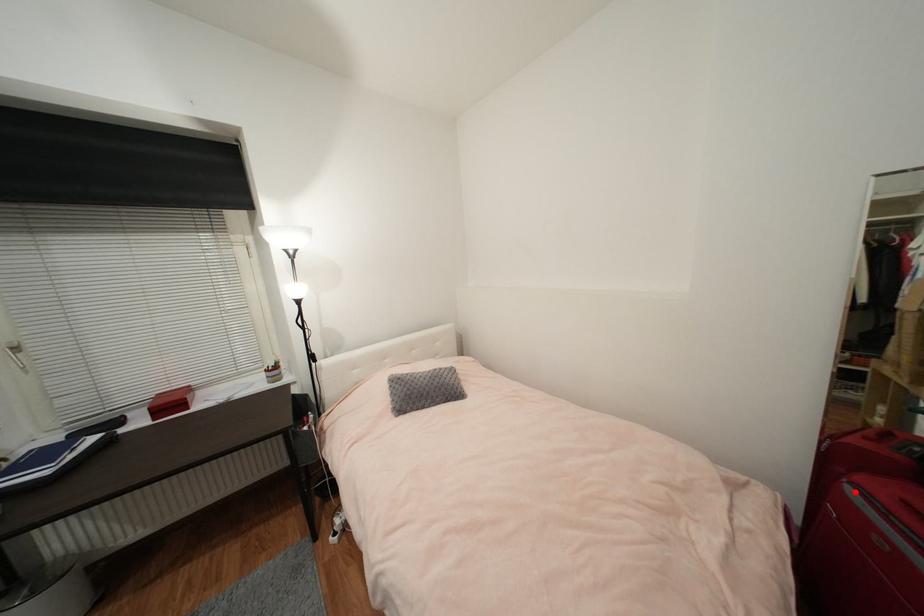
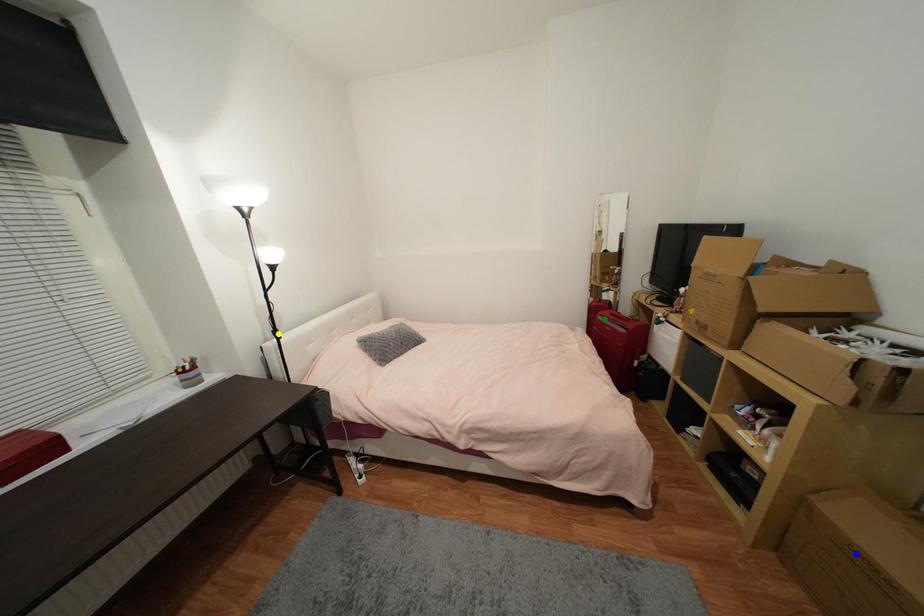
Question: I am providing you with two images of the same scene from different viewpoints. A red point is marked on the first image. You are given multiple points on the second image. Which mark in image 2 goes with the point in image 1?

Choices:
 (A) blue point
 (B) yellow point
 (C) green point

Answer: (C)